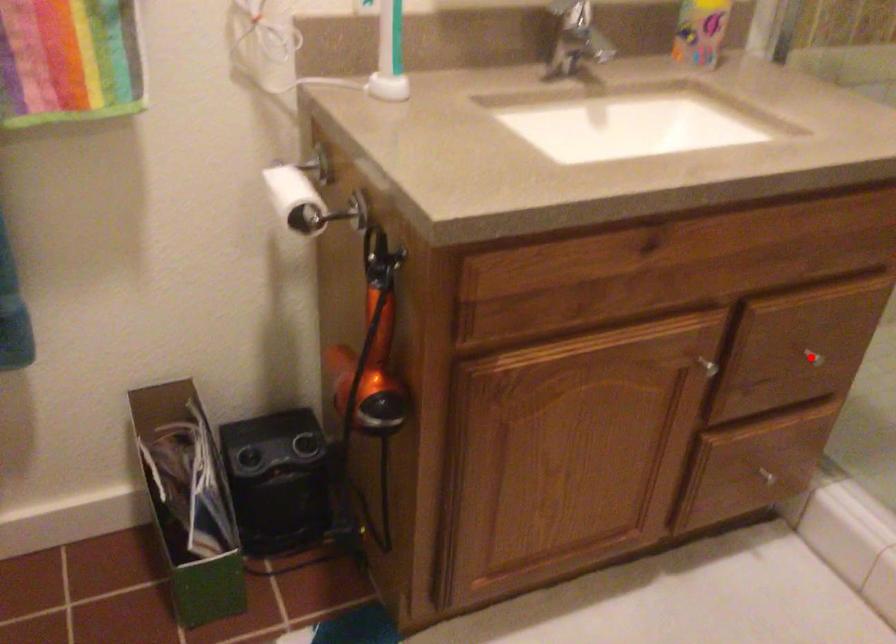
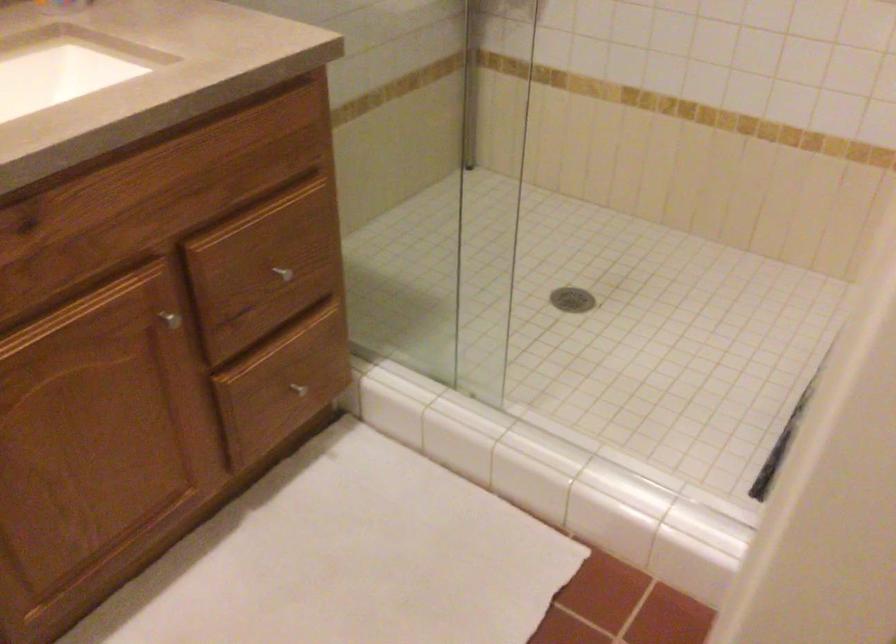
In the second image, find the point that corresponds to the highlighted location in the first image.

(281, 272)